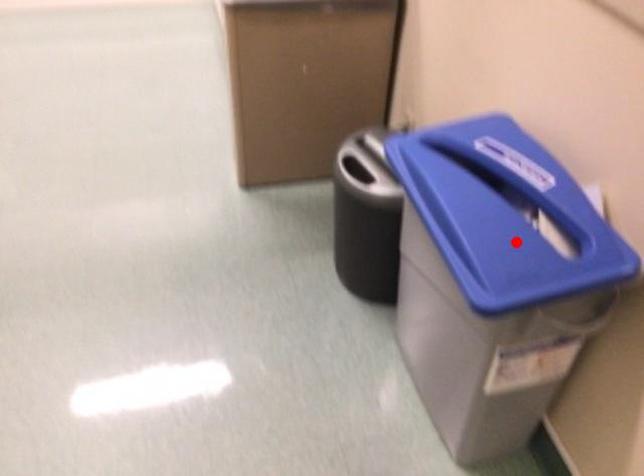
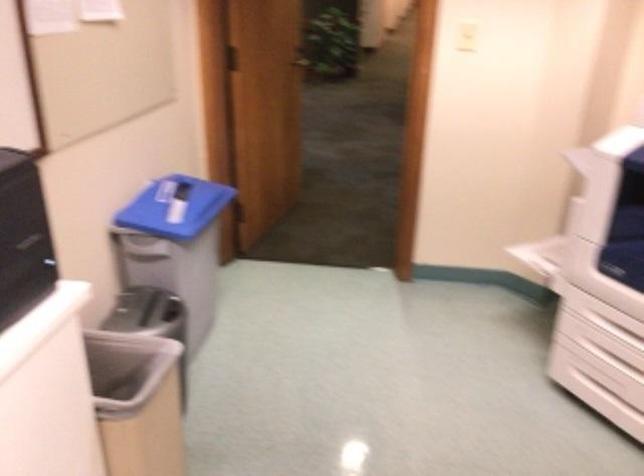
Question: I am providing you with two images of the same scene from different viewpoints. In image1, a red point is highlighted. Considering the same 3D point in image2, which of the following is correct?

Choices:
 (A) It is closer
 (B) It is farther

Answer: (B)